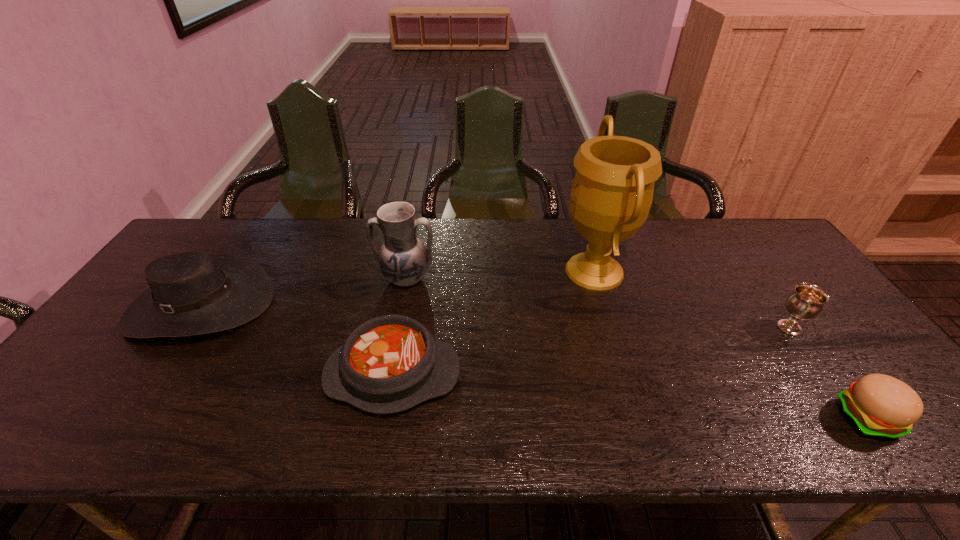
Where is `free spot that satisfies the following two spatial constraints: 1. on the front-facing side of the fourth shortest object; 2. on the right side of the hamburger`? The image size is (960, 540). free spot that satisfies the following two spatial constraints: 1. on the front-facing side of the fourth shortest object; 2. on the right side of the hamburger is located at coordinates (125, 418).